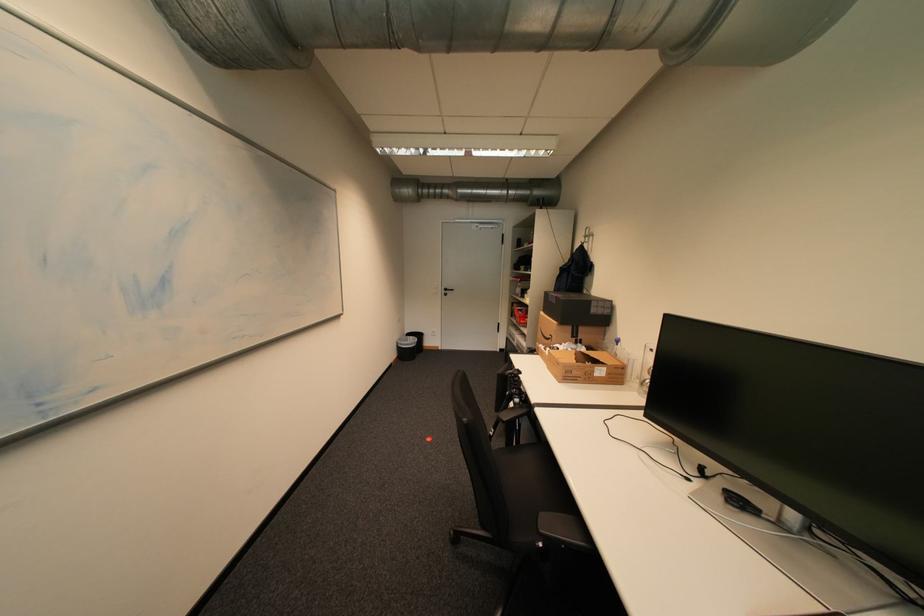
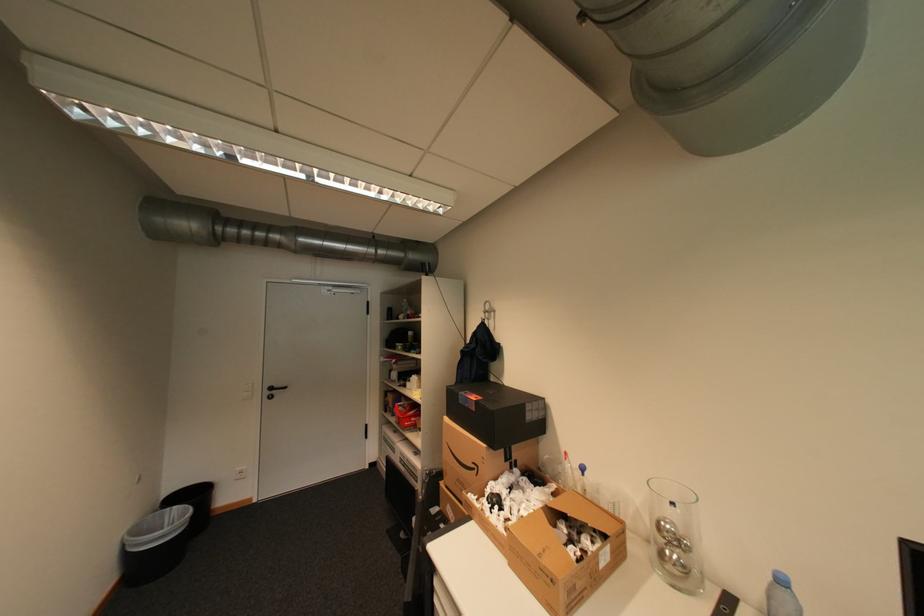
Where in the second image is the point corresponding to [455,290] from the first image?

(280, 389)